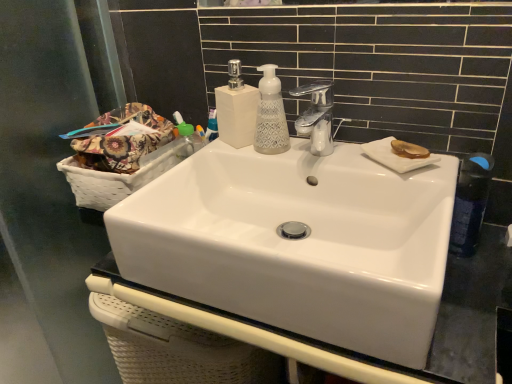
Question: Is transparent glass screen door at left wider than blue plastic mouthwash at upper center?

Choices:
 (A) no
 (B) yes

Answer: (B)

Question: From a real-world perspective, is transparent glass screen door at left physically below blue plastic mouthwash at upper center?

Choices:
 (A) no
 (B) yes

Answer: (B)

Question: Does transparent glass screen door at left have a greater height compared to blue plastic mouthwash at upper center?

Choices:
 (A) yes
 (B) no

Answer: (A)

Question: Can you confirm if transparent glass screen door at left is shorter than blue plastic mouthwash at upper center?

Choices:
 (A) yes
 (B) no

Answer: (B)

Question: Considering the relative sizes of transparent glass screen door at left and blue plastic mouthwash at upper center in the image provided, is transparent glass screen door at left thinner than blue plastic mouthwash at upper center?

Choices:
 (A) yes
 (B) no

Answer: (B)

Question: Relative to white woven basket at left, is translucent amber plate at upper right in front or behind?

Choices:
 (A) front
 (B) behind

Answer: (A)

Question: Visually, is translucent amber plate at upper right positioned to the left or to the right of white woven basket at left?

Choices:
 (A) right
 (B) left

Answer: (A)

Question: Looking at their shapes, would you say translucent amber plate at upper right is wider or thinner than white woven basket at left?

Choices:
 (A) thin
 (B) wide

Answer: (A)

Question: In terms of size, does translucent amber plate at upper right appear bigger or smaller than white woven basket at left?

Choices:
 (A) big
 (B) small

Answer: (B)

Question: Is transparent glass screen door at left inside or outside of blue plastic mouthwash at upper center?

Choices:
 (A) outside
 (B) inside

Answer: (A)

Question: From a real-world perspective, relative to blue plastic mouthwash at upper center, is transparent glass screen door at left vertically above or below?

Choices:
 (A) above
 (B) below

Answer: (B)

Question: Looking at their shapes, would you say transparent glass screen door at left is wider or thinner than blue plastic mouthwash at upper center?

Choices:
 (A) thin
 (B) wide

Answer: (B)

Question: From the image's perspective, is transparent glass screen door at left located above or below blue plastic mouthwash at upper center?

Choices:
 (A) below
 (B) above

Answer: (A)

Question: Visually, is blue plastic mouthwash at upper center positioned to the left or to the right of white textured soap dispenser at center, which is the 1th soap dispenser from right to left?

Choices:
 (A) left
 (B) right

Answer: (A)

Question: Is blue plastic mouthwash at upper center bigger or smaller than white textured soap dispenser at center, which is the 1th soap dispenser from right to left?

Choices:
 (A) big
 (B) small

Answer: (B)